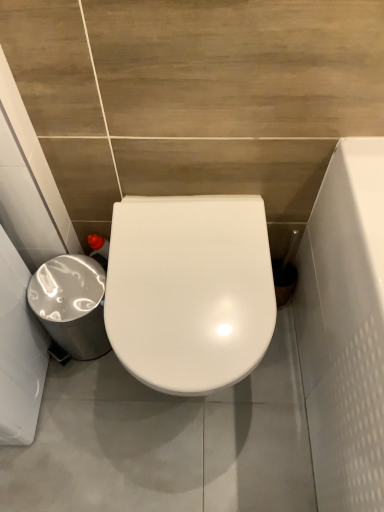
Find the location of a particular element. The height and width of the screenshot is (512, 384). silver metallic trash can at lower left is located at coordinates (71, 304).

Measure the distance between point (94, 283) and camera.

Point (94, 283) and camera are 3.65 feet apart from each other.

What do you see at coordinates (71, 304) in the screenshot?
I see `silver metallic trash can at lower left` at bounding box center [71, 304].

Identify the location of white glossy toilet at center. (189, 290).

This screenshot has height=512, width=384. What do you see at coordinates (189, 290) in the screenshot?
I see `white glossy toilet at center` at bounding box center [189, 290].

Consider the image. Measure the distance between white glossy toilet at center and camera.

The distance of white glossy toilet at center from camera is 31.65 inches.

This screenshot has width=384, height=512. What are the coordinates of `silver metallic trash can at lower left` in the screenshot? It's located at (71, 304).

Which is more to the right, silver metallic trash can at lower left or white glossy toilet at center?

white glossy toilet at center.

Which is in front, silver metallic trash can at lower left or white glossy toilet at center?

Positioned in front is white glossy toilet at center.

Is point (102, 332) positioned before point (245, 325)?

No.

From the image's perspective, is silver metallic trash can at lower left located beneath white glossy toilet at center?

Incorrect, from the image's perspective, silver metallic trash can at lower left is higher than white glossy toilet at center.

From a real-world perspective, between silver metallic trash can at lower left and white glossy toilet at center, who is vertically higher?

From a 3D spatial view, white glossy toilet at center is above.

Which of these two, silver metallic trash can at lower left or white glossy toilet at center, is thinner?

silver metallic trash can at lower left.

Does silver metallic trash can at lower left have a greater height compared to white glossy toilet at center?

No, silver metallic trash can at lower left is not taller than white glossy toilet at center.

Considering the sizes of objects silver metallic trash can at lower left and white glossy toilet at center in the image provided, who is bigger, silver metallic trash can at lower left or white glossy toilet at center?

white glossy toilet at center.

Looking at this image, is white glossy toilet at center completely or partially inside silver metallic trash can at lower left?

Actually, white glossy toilet at center is outside silver metallic trash can at lower left.

Does silver metallic trash can at lower left touch white glossy toilet at center?

silver metallic trash can at lower left and white glossy toilet at center are clearly separated.

Does silver metallic trash can at lower left turn towards white glossy toilet at center?

No, silver metallic trash can at lower left does not turn towards white glossy toilet at center.

What's the angular difference between silver metallic trash can at lower left and white glossy toilet at center's facing directions?

The facing directions of silver metallic trash can at lower left and white glossy toilet at center are 1.05e-05 degrees apart.

Image resolution: width=384 pixels, height=512 pixels. Find the location of `toilet located on the right of silver metallic trash can at lower left`. toilet located on the right of silver metallic trash can at lower left is located at coordinates (189, 290).

Would you say white glossy toilet at center is to the left or to the right of silver metallic trash can at lower left in the picture?

white glossy toilet at center is positioned on silver metallic trash can at lower left's right side.

Is white glossy toilet at center in front of or behind silver metallic trash can at lower left in the image?

white glossy toilet at center is in front of silver metallic trash can at lower left.

Is point (166, 381) positioned after point (46, 304)?

No, it is in front of (46, 304).

From the image's perspective, would you say white glossy toilet at center is shown under silver metallic trash can at lower left?

Yes, from the image's perspective, white glossy toilet at center is below silver metallic trash can at lower left.

From a real-world perspective, which is physically above, white glossy toilet at center or silver metallic trash can at lower left?

white glossy toilet at center is physically above.

Considering the sizes of white glossy toilet at center and silver metallic trash can at lower left in the image, is white glossy toilet at center wider or thinner than silver metallic trash can at lower left?

Considering their sizes, white glossy toilet at center looks broader than silver metallic trash can at lower left.

Considering the relative sizes of white glossy toilet at center and silver metallic trash can at lower left in the image provided, is white glossy toilet at center shorter than silver metallic trash can at lower left?

In fact, white glossy toilet at center may be taller than silver metallic trash can at lower left.

Who is bigger, white glossy toilet at center or silver metallic trash can at lower left?

Bigger between the two is white glossy toilet at center.

Is white glossy toilet at center completely or partially outside of silver metallic trash can at lower left?

white glossy toilet at center lies outside silver metallic trash can at lower left's area.

Would you consider white glossy toilet at center to be distant from silver metallic trash can at lower left?

Actually, white glossy toilet at center and silver metallic trash can at lower left are a little close together.

Is white glossy toilet at center turned away from silver metallic trash can at lower left?

white glossy toilet at center does not have its back to silver metallic trash can at lower left.

How different are the orientations of white glossy toilet at center and silver metallic trash can at lower left in degrees?

The angle between the facing direction of white glossy toilet at center and the facing direction of silver metallic trash can at lower left is 1.05e-05 degrees.

The height and width of the screenshot is (512, 384). I want to click on porcelain behind the white glossy toilet at center, so click(x=71, y=304).

Locate an element on the screen. porcelain above the white glossy toilet at center (from the image's perspective) is located at coordinates (71, 304).

Locate an element on the screen. The image size is (384, 512). porcelain on the left of white glossy toilet at center is located at coordinates (71, 304).